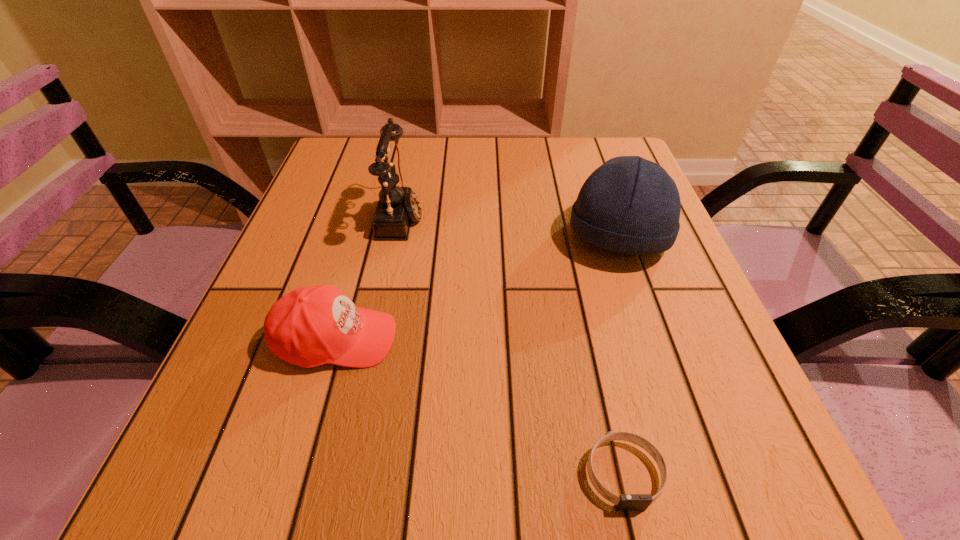
Find the location of a particular element. The image size is (960, 540). unoccupied position between the baseball cap and the telephone is located at coordinates [369, 277].

Identify the location of free space that is in between the skullcap and the baseball cap. The image size is (960, 540). (477, 288).

At what (x,y) coordinates should I click in order to perform the action: click on vacant area between the tallest object and the wristband. Please return your answer as a coordinate pair (x, y). This screenshot has height=540, width=960. Looking at the image, I should click on (513, 345).

This screenshot has width=960, height=540. I want to click on free space between the wristband and the baseball cap, so (480, 406).

Find the location of a particular element. free space between the second shortest object and the telephone is located at coordinates (369, 277).

Where is `free spot between the baseball cap and the nearest object`? The width and height of the screenshot is (960, 540). free spot between the baseball cap and the nearest object is located at coordinates (480, 406).

You are a GUI agent. You are given a task and a screenshot of the screen. Output one action in this format:
    pyautogui.click(x=<x>, y=<y>)
    Task: Click on the free space between the telephone and the second shortest object
    
    Given the screenshot: What is the action you would take?
    pyautogui.click(x=369, y=277)

The height and width of the screenshot is (540, 960). I want to click on blank region between the third tallest object and the second tallest object, so click(477, 288).

This screenshot has width=960, height=540. Identify the location of vacant area that lies between the wristband and the tallest object. (513, 345).

Locate an element on the screen. This screenshot has height=540, width=960. object that is the third closest one to the nearest object is located at coordinates (397, 206).